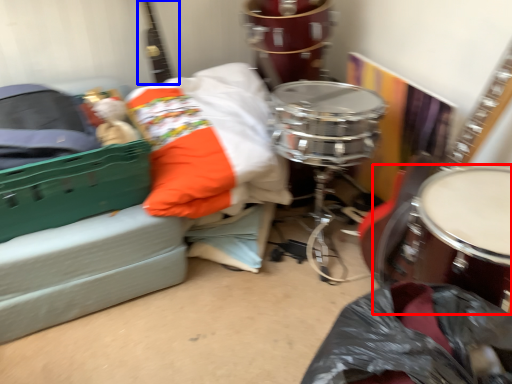
Question: Which of the following is the farthest to the observer, drum (highlighted by a red box) or guitar (highlighted by a blue box)?

Choices:
 (A) drum
 (B) guitar

Answer: (B)